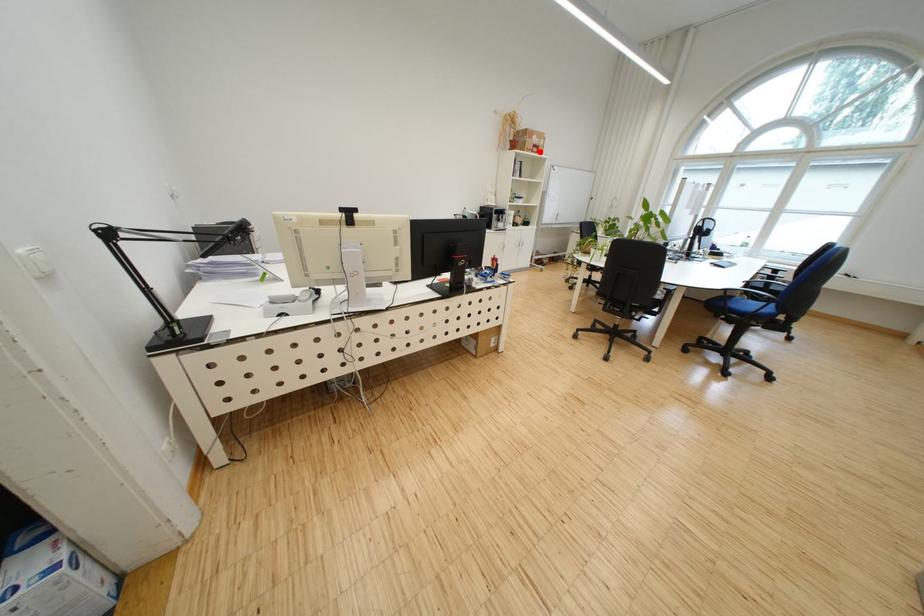
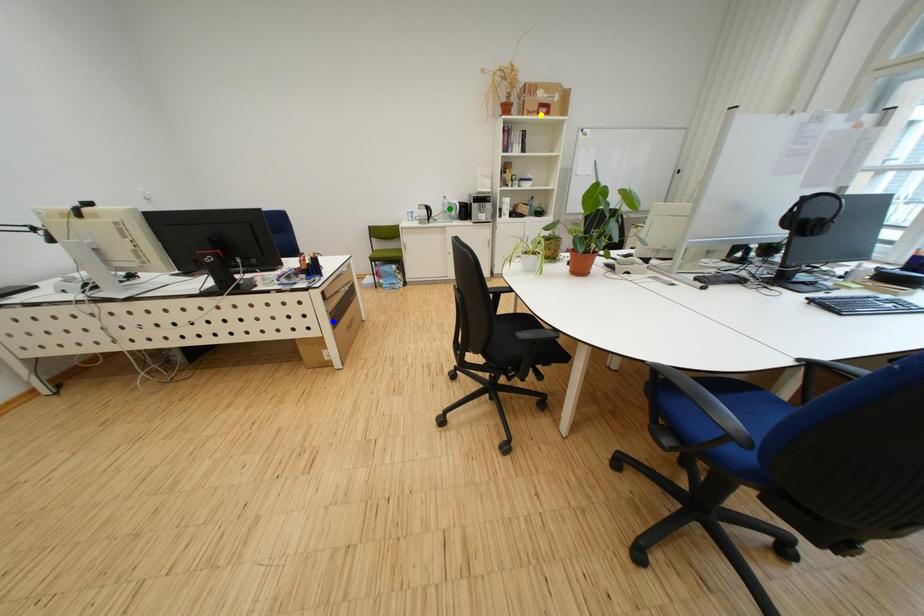
Question: I am providing you with two images of the same scene from different viewpoints. A red point is marked on the first image. You are given multiple points on the second image. Can you choose the point in image 2 that corresponds to the point in image 1?

Choices:
 (A) yellow point
 (B) blue point
 (C) green point

Answer: (A)